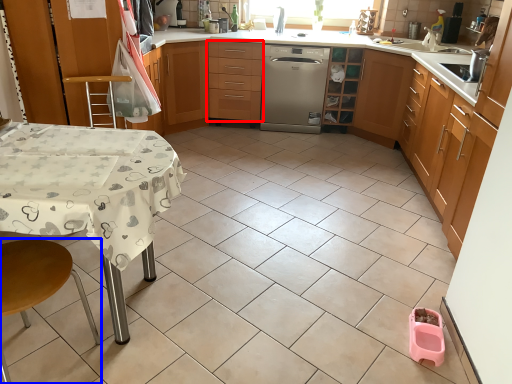
Question: Which point is closer to the camera, drawer (highlighted by a red box) or step stool (highlighted by a blue box)?

Choices:
 (A) drawer
 (B) step stool

Answer: (B)